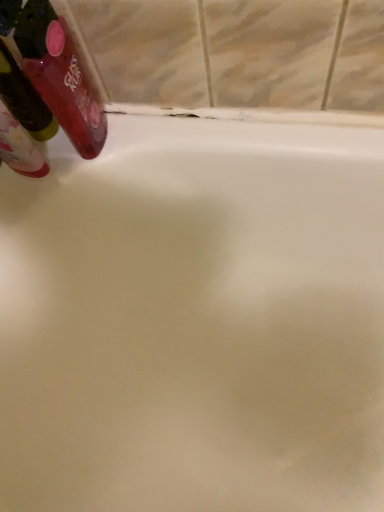
At what (x,y) coordinates should I click in order to perform the action: click on free location to the right of translucent plastic mouthwash at upper left, the second mouthwash viewed from the right. Please return your answer as a coordinate pair (x, y). This screenshot has width=384, height=512. Looking at the image, I should click on (137, 142).